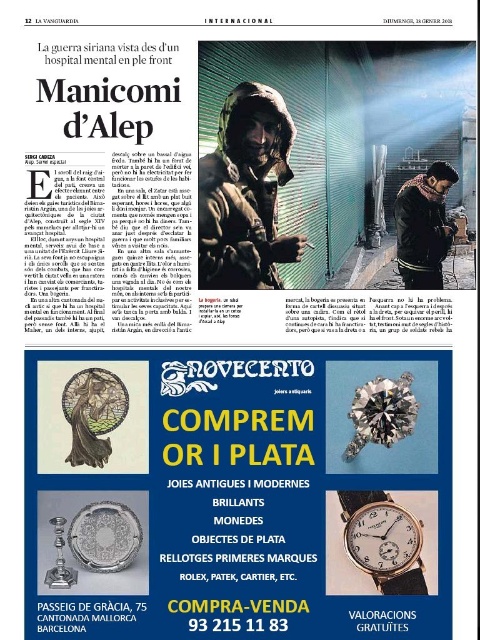
Question: Where is matte black jacket at center located in relation to dark wool scarf at upper right in the image?

Choices:
 (A) right
 (B) left

Answer: (B)

Question: Is matte black jacket at center to the right of dark wool scarf at upper right from the viewer's perspective?

Choices:
 (A) no
 (B) yes

Answer: (A)

Question: Which object is closer to the camera taking this photo?

Choices:
 (A) matte black jacket at center
 (B) gold/brass watch at center

Answer: (B)

Question: Which of the following is the farthest from the observer?

Choices:
 (A) dark wool scarf at upper right
 (B) matte black jacket at center

Answer: (A)

Question: Is matte black jacket at center smaller than gold/brass watch at center?

Choices:
 (A) yes
 (B) no

Answer: (B)

Question: Considering the real-world distances, which object is farthest from the matte black jacket at center?

Choices:
 (A) gold/brass watch at center
 (B) dark wool scarf at upper right

Answer: (B)